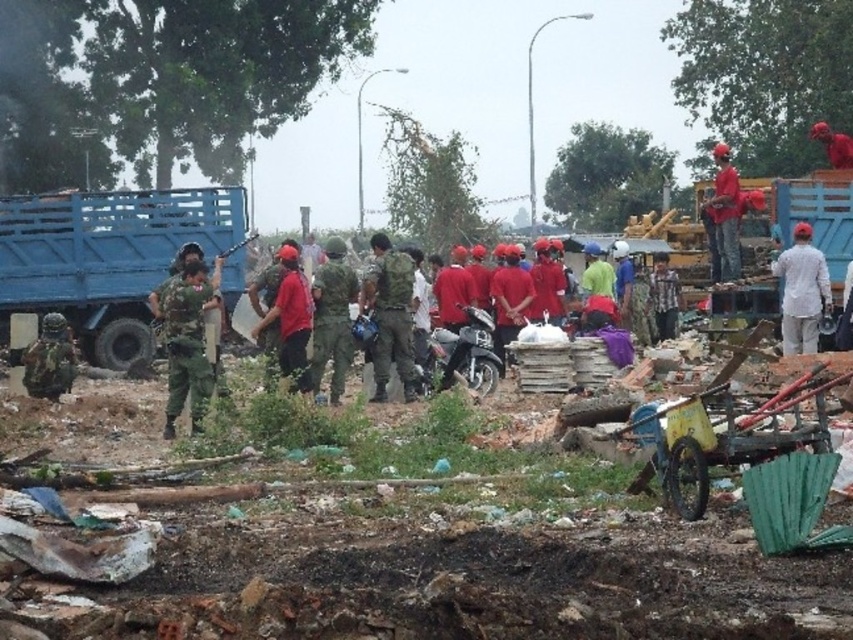
Question: Which point appears farthest from the camera in this image?

Choices:
 (A) click(x=392, y=259)
 (B) click(x=57, y=196)

Answer: (B)

Question: Can you confirm if blue matte truck at left is positioned to the left of camouflage fabric uniform at center?

Choices:
 (A) yes
 (B) no

Answer: (A)

Question: Is blue matte truck at left positioned behind camouflage fabric uniform at center?

Choices:
 (A) yes
 (B) no

Answer: (A)

Question: Which of the following is the farthest from the observer?

Choices:
 (A) (109, 308)
 (B) (408, 307)

Answer: (A)

Question: In this image, where is blue matte truck at left located relative to camouflage fabric uniform at center?

Choices:
 (A) above
 (B) below

Answer: (A)

Question: Which object appears closest to the camera in this image?

Choices:
 (A) blue matte truck at left
 (B) camouflage fabric uniform at center

Answer: (B)